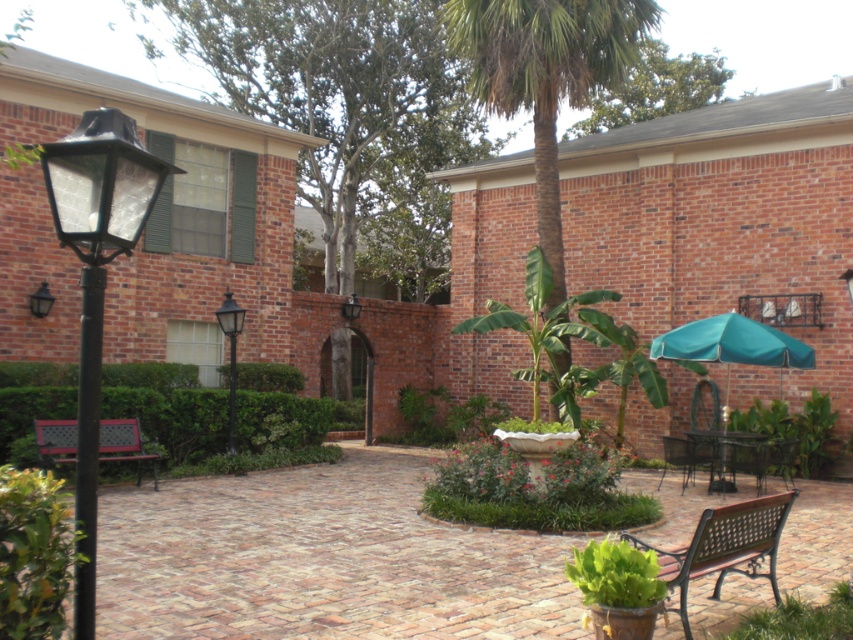
Is point (540, 113) positioned in front of point (119, 444)?

No.

Does green leafy palm tree at center lie in front of wooden bench at lower left?

No, it is not.

What do you see at coordinates (546, 76) in the screenshot? I see `green leafy palm tree at center` at bounding box center [546, 76].

You are a GUI agent. You are given a task and a screenshot of the screen. Output one action in this format:
    pyautogui.click(x=<x>, y=<y>)
    Task: Click on the green leafy palm tree at center
    Image resolution: width=853 pixels, height=640 pixels.
    Given the screenshot: What is the action you would take?
    pyautogui.click(x=546, y=76)

Who is shorter, black glass lamp at left or matte black lamp at upper center?

With less height is matte black lamp at upper center.

Find the location of a particular element. black glass lamp at left is located at coordinates (39, 300).

Image resolution: width=853 pixels, height=640 pixels. In order to click on black glass lamp at left in this screenshot , I will do `click(39, 300)`.

Between white stone birdbath at center and brown wooden bench at lower right, which one appears on the right side from the viewer's perspective?

brown wooden bench at lower right

Can you confirm if white stone birdbath at center is positioned to the right of brown wooden bench at lower right?

Incorrect, white stone birdbath at center is not on the right side of brown wooden bench at lower right.

Who is more forward, (x=514, y=467) or (x=743, y=528)?

Point (x=743, y=528) is more forward.

In order to click on white stone birdbath at center in this screenshot , I will do `click(534, 490)`.